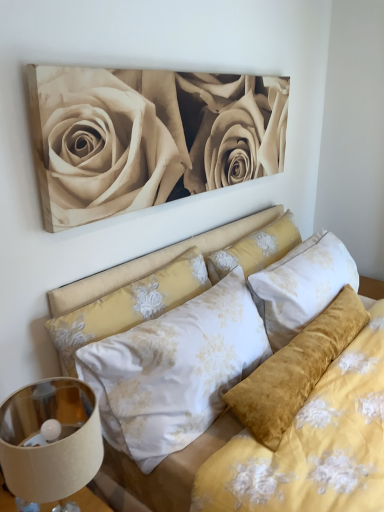
This screenshot has height=512, width=384. What do you see at coordinates (129, 306) in the screenshot?
I see `white floral fabric pillow at center, the second pillow when ordered from right to left` at bounding box center [129, 306].

Find the location of a particular element. The image size is (384, 512). white floral fabric pillow at center, the second pillow when ordered from right to left is located at coordinates (129, 306).

Identify the location of velvet yellow pillow at center, which is the 1th pillow from right to left. This screenshot has height=512, width=384. (256, 249).

Image resolution: width=384 pixels, height=512 pixels. What are the coordinates of `metallic beige lampshade at lower left` in the screenshot? It's located at (50, 443).

Does beige matte/soft canvas at upper center turn towards metallic beige lampshade at lower left?

No, beige matte/soft canvas at upper center is not facing towards metallic beige lampshade at lower left.

Is metallic beige lampshade at lower left completely or partially inside beige matte/soft canvas at upper center?

No, metallic beige lampshade at lower left is not surrounded by beige matte/soft canvas at upper center.

Is beige matte/soft canvas at upper center directly adjacent to metallic beige lampshade at lower left?

No, beige matte/soft canvas at upper center is not making contact with metallic beige lampshade at lower left.

How many degrees apart are the facing directions of beige matte/soft canvas at upper center and metallic beige lampshade at lower left?

The angle between the facing direction of beige matte/soft canvas at upper center and the facing direction of metallic beige lampshade at lower left is 0.00261 degrees.

Which is less distant, (83, 486) or (154, 139)?

Positioned in front is point (83, 486).

Looking at this image, is metallic beige lampshade at lower left far away from beige matte/soft canvas at upper center?

No, metallic beige lampshade at lower left is not far from beige matte/soft canvas at upper center.

This screenshot has width=384, height=512. In order to click on lamp below the beige matte/soft canvas at upper center (from a real-world perspective) in this screenshot , I will do `click(50, 443)`.

From the image's perspective, which is below, beige matte/soft canvas at upper center or velvet yellow bed at center?

From the image's view, velvet yellow bed at center is below.

Which of these two, beige matte/soft canvas at upper center or velvet yellow bed at center, is bigger?

With larger size is velvet yellow bed at center.

From the picture: Can you confirm if beige matte/soft canvas at upper center is taller than velvet yellow bed at center?

In fact, beige matte/soft canvas at upper center may be shorter than velvet yellow bed at center.

Which of these two, metallic beige lampshade at lower left or white floral fabric pillow at center, placed as the first pillow when sorted from left to right, is thinner?

With smaller width is white floral fabric pillow at center, placed as the first pillow when sorted from left to right.

How much distance is there between metallic beige lampshade at lower left and white floral fabric pillow at center, the second pillow when ordered from right to left?

The distance of metallic beige lampshade at lower left from white floral fabric pillow at center, the second pillow when ordered from right to left, is 12.20 inches.

From the image's perspective, would you say metallic beige lampshade at lower left is positioned over white floral fabric pillow at center, placed as the first pillow when sorted from left to right?

No.

Consider the image. Considering the relative sizes of metallic beige lampshade at lower left and white floral fabric pillow at center, placed as the first pillow when sorted from left to right, in the image provided, is metallic beige lampshade at lower left shorter than white floral fabric pillow at center, placed as the first pillow when sorted from left to right,?

Yes, metallic beige lampshade at lower left is shorter than white floral fabric pillow at center, placed as the first pillow when sorted from left to right.

Is velvet yellow pillow at center, which is the 1th pillow from right to left, not close to velvet yellow bed at center?

No, there isn't a large distance between velvet yellow pillow at center, which is the 1th pillow from right to left, and velvet yellow bed at center.

Is velvet yellow pillow at center, which is the 1th pillow from right to left, looking in the opposite direction of velvet yellow bed at center?

velvet yellow pillow at center, which is the 1th pillow from right to left, does not have its back to velvet yellow bed at center.

From a real-world perspective, which is physically below, velvet yellow pillow at center, the second pillow in the left-to-right sequence, or velvet yellow bed at center?

velvet yellow bed at center.

Measure the distance from velvet yellow pillow at center, the second pillow in the left-to-right sequence, to velvet yellow bed at center.

velvet yellow pillow at center, the second pillow in the left-to-right sequence, and velvet yellow bed at center are 4.05 inches apart from each other.

From the picture: From the image's perspective, is velvet yellow bed at center on top of metallic beige lampshade at lower left?

Yes, from the image's perspective, velvet yellow bed at center is above metallic beige lampshade at lower left.

Locate an element on the screen. lamp to the left of velvet yellow bed at center is located at coordinates (50, 443).

From a real-world perspective, is velvet yellow bed at center on top of metallic beige lampshade at lower left?

Yes.

Between velvet yellow bed at center and metallic beige lampshade at lower left, which one has larger width?

Wider between the two is velvet yellow bed at center.

Is beige matte/soft canvas at upper center in front of white floral fabric pillow at center, placed as the first pillow when sorted from left to right?

Yes, it is in front of white floral fabric pillow at center, placed as the first pillow when sorted from left to right.

Who is taller, beige matte/soft canvas at upper center or white floral fabric pillow at center, the second pillow when ordered from right to left?

beige matte/soft canvas at upper center.

Is beige matte/soft canvas at upper center not close to white floral fabric pillow at center, placed as the first pillow when sorted from left to right?

They are positioned close to each other.

Is beige matte/soft canvas at upper center facing towards white floral fabric pillow at center, placed as the first pillow when sorted from left to right?

No, beige matte/soft canvas at upper center is not turned towards white floral fabric pillow at center, placed as the first pillow when sorted from left to right.

In the image, there is a beige matte/soft canvas at upper center. In order to click on lamp below it (from the image's perspective) in this screenshot , I will do `click(50, 443)`.

Image resolution: width=384 pixels, height=512 pixels. What are the coordinates of `rose lying above the metallic beige lampshade at lower left (from the image's perspective)` in the screenshot? It's located at (149, 137).

Estimate the real-world distances between objects in this image. Which object is further from white floral fabric pillow at center, the second pillow when ordered from right to left, velvet yellow bed at center or metallic beige lampshade at lower left?

metallic beige lampshade at lower left.

Estimate the real-world distances between objects in this image. Which object is closer to white floral fabric pillow at center, the second pillow when ordered from right to left, velvet yellow bed at center or beige matte/soft canvas at upper center?

velvet yellow bed at center lies closer to white floral fabric pillow at center, the second pillow when ordered from right to left, than the other object.

Looking at this image, based on their spatial positions, is velvet yellow bed at center or beige matte/soft canvas at upper center closer to velvet yellow pillow at center, the second pillow in the left-to-right sequence?

velvet yellow bed at center is positioned closer to the anchor velvet yellow pillow at center, the second pillow in the left-to-right sequence.

Which object lies further to the anchor point velvet yellow pillow at center, which is the 1th pillow from right to left, beige matte/soft canvas at upper center or metallic beige lampshade at lower left?

metallic beige lampshade at lower left is positioned further to the anchor velvet yellow pillow at center, which is the 1th pillow from right to left.

Estimate the real-world distances between objects in this image. Which object is closer to beige matte/soft canvas at upper center, velvet yellow pillow at center, the second pillow in the left-to-right sequence, or velvet yellow bed at center?

The object closer to beige matte/soft canvas at upper center is velvet yellow bed at center.

Estimate the real-world distances between objects in this image. Which object is further from velvet yellow pillow at center, the second pillow in the left-to-right sequence, metallic beige lampshade at lower left or white floral fabric pillow at center, the second pillow when ordered from right to left?

Based on the image, metallic beige lampshade at lower left appears to be further to velvet yellow pillow at center, the second pillow in the left-to-right sequence.

From the image, which object appears to be farther from beige matte/soft canvas at upper center, white floral fabric pillow at center, placed as the first pillow when sorted from left to right, or velvet yellow bed at center?

white floral fabric pillow at center, placed as the first pillow when sorted from left to right.

Based on their spatial positions, is beige matte/soft canvas at upper center or velvet yellow bed at center closer to white floral fabric pillow at center, the second pillow when ordered from right to left?

velvet yellow bed at center lies closer to white floral fabric pillow at center, the second pillow when ordered from right to left, than the other object.

At what (x,y) coordinates should I click in order to perform the action: click on pillow located between velvet yellow bed at center and velvet yellow pillow at center, which is the 1th pillow from right to left, in the depth direction. Please return your answer as a coordinate pair (x, y). The width and height of the screenshot is (384, 512). Looking at the image, I should click on (129, 306).

Where is `pillow that lies between beige matte/soft canvas at upper center and white floral fabric pillow at center, the second pillow when ordered from right to left, from top to bottom`? pillow that lies between beige matte/soft canvas at upper center and white floral fabric pillow at center, the second pillow when ordered from right to left, from top to bottom is located at coordinates (256, 249).

At what (x,y) coordinates should I click in order to perform the action: click on bed between metallic beige lampshade at lower left and velvet yellow pillow at center, the second pillow in the left-to-right sequence, from front to back. Please return your answer as a coordinate pair (x, y). The image size is (384, 512). Looking at the image, I should click on (161, 277).

Image resolution: width=384 pixels, height=512 pixels. I want to click on bed between beige matte/soft canvas at upper center and metallic beige lampshade at lower left from top to bottom, so click(x=161, y=277).